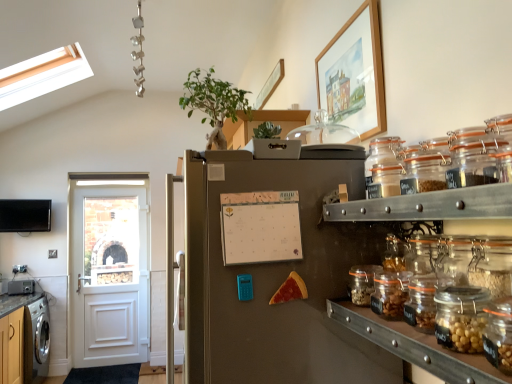
Question: Considering the relative sizes of stainless steel refrigerator at center and green leafy plant at upper center in the image provided, is stainless steel refrigerator at center smaller than green leafy plant at upper center?

Choices:
 (A) yes
 (B) no

Answer: (B)

Question: Is stainless steel refrigerator at center far away from green leafy plant at upper center?

Choices:
 (A) yes
 (B) no

Answer: (B)

Question: Is stainless steel refrigerator at center next to green leafy plant at upper center and touching it?

Choices:
 (A) yes
 (B) no

Answer: (B)

Question: From the image's perspective, is stainless steel refrigerator at center under green leafy plant at upper center?

Choices:
 (A) no
 (B) yes

Answer: (B)

Question: Is stainless steel refrigerator at center to the left of green leafy plant at upper center from the viewer's perspective?

Choices:
 (A) no
 (B) yes

Answer: (A)

Question: Is clear glass jar at center-right, marked as the 4th glass jar in a top-to-bottom arrangement, wider or thinner than brushed metal countertop at lower left?

Choices:
 (A) wide
 (B) thin

Answer: (B)

Question: In the image, is clear glass jar at center-right, the first glass jar from the bottom, positioned in front of or behind brushed metal countertop at lower left?

Choices:
 (A) front
 (B) behind

Answer: (A)

Question: Visually, is clear glass jar at center-right, the first glass jar from the bottom, positioned to the left or to the right of brushed metal countertop at lower left?

Choices:
 (A) right
 (B) left

Answer: (A)

Question: Is clear glass jar at center-right, marked as the 4th glass jar in a top-to-bottom arrangement, spatially inside brushed metal countertop at lower left, or outside of it?

Choices:
 (A) outside
 (B) inside

Answer: (A)

Question: Is brushed metal toaster at lower left wider or thinner than brushed metal countertop at lower left?

Choices:
 (A) wide
 (B) thin

Answer: (B)

Question: Is point [x=8, y=281] positioned closer to the camera than point [x=17, y=297]?

Choices:
 (A) farther
 (B) closer

Answer: (A)

Question: In the image, is brushed metal toaster at lower left on the left side or the right side of brushed metal countertop at lower left?

Choices:
 (A) right
 (B) left

Answer: (B)

Question: From the image's perspective, is brushed metal toaster at lower left above or below brushed metal countertop at lower left?

Choices:
 (A) below
 (B) above

Answer: (B)

Question: Is cheesy pizza slice at center in front of or behind wooden-framed painting at upper right in the image?

Choices:
 (A) behind
 (B) front

Answer: (B)

Question: Does point (295, 279) appear closer or farther from the camera than point (334, 36)?

Choices:
 (A) closer
 (B) farther

Answer: (A)